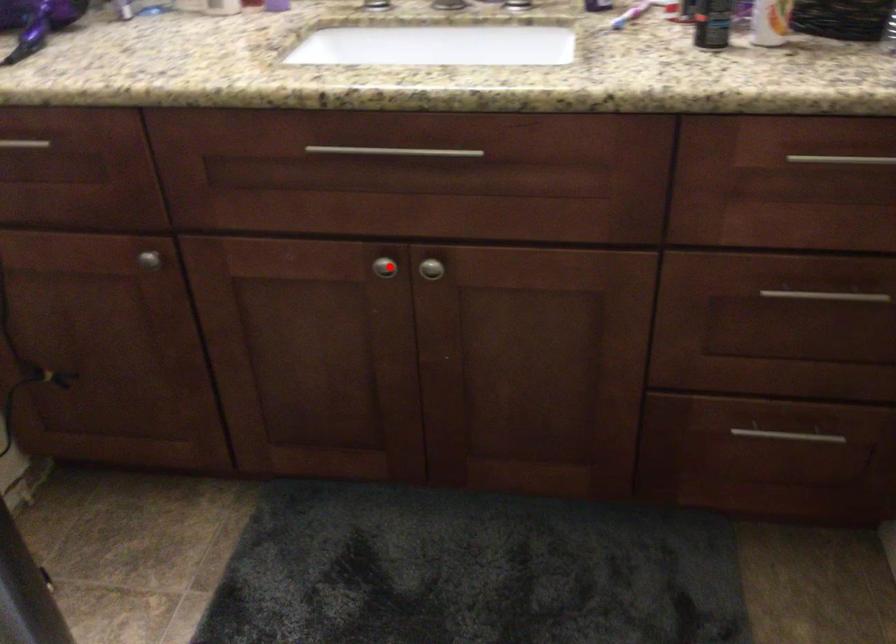
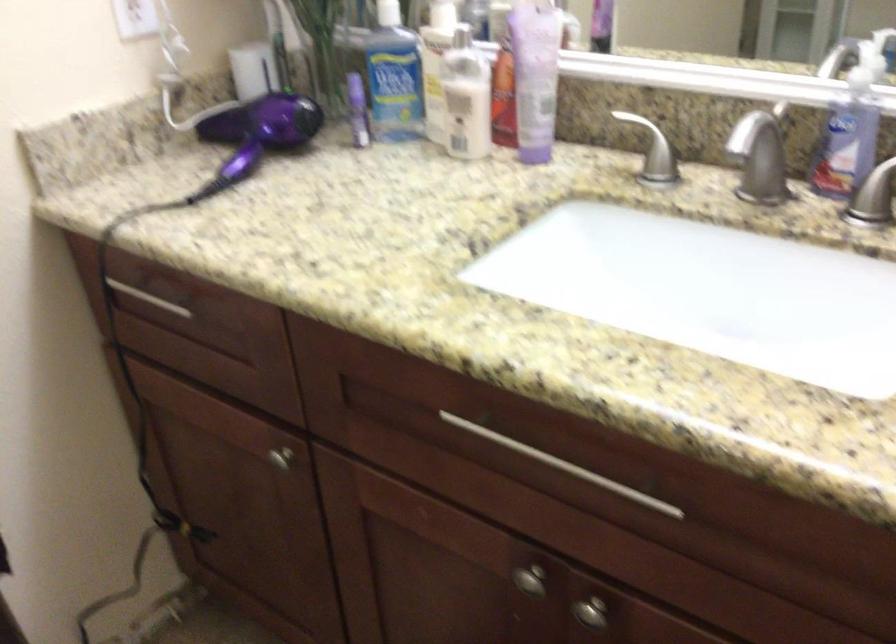
Locate, in the second image, the point that corresponds to the highlighted location in the first image.

(530, 580)